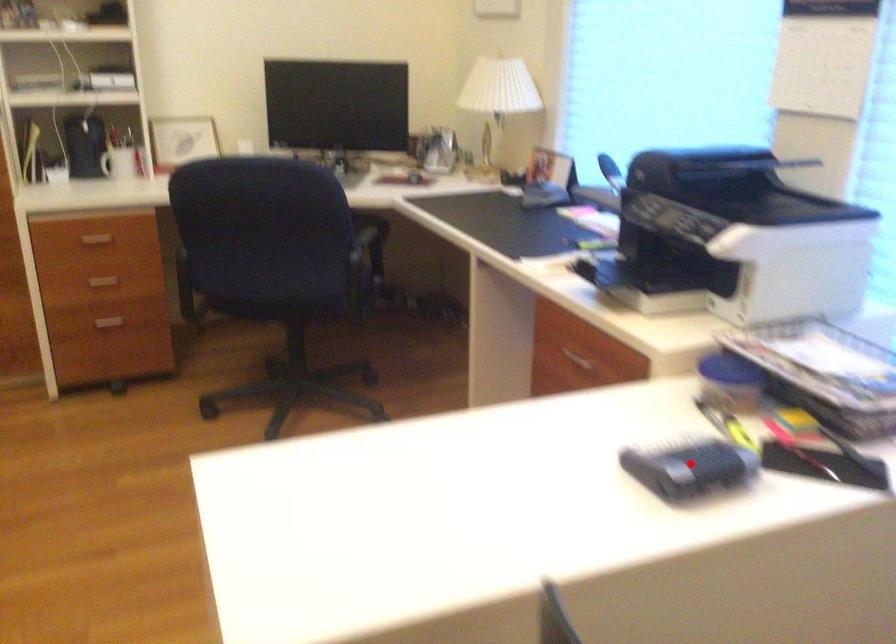
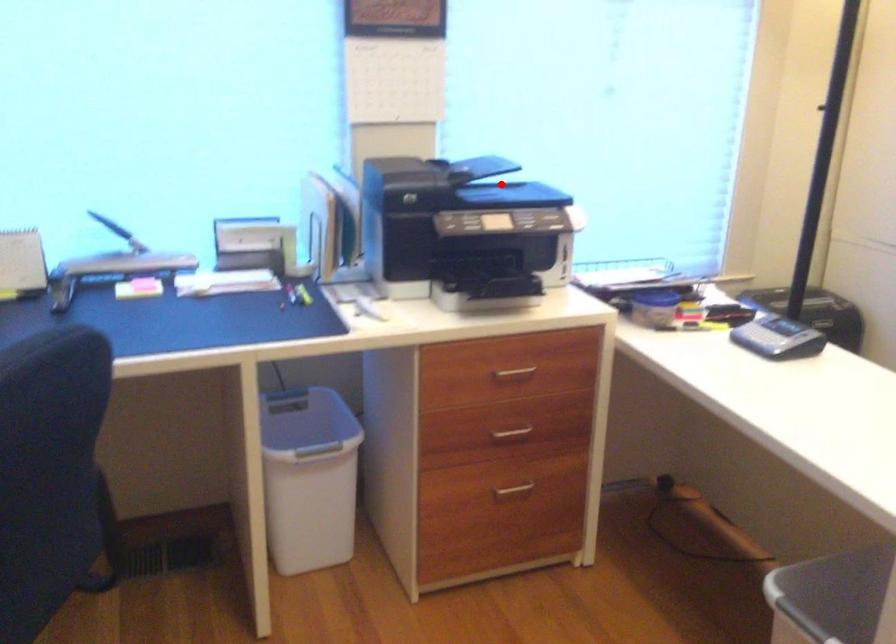
I am providing you with two images of the same scene from different viewpoints. A red point is marked on the first image and another point is marked on the second image. Do the highlighted points in image1 and image2 indicate the same real-world spot?

No